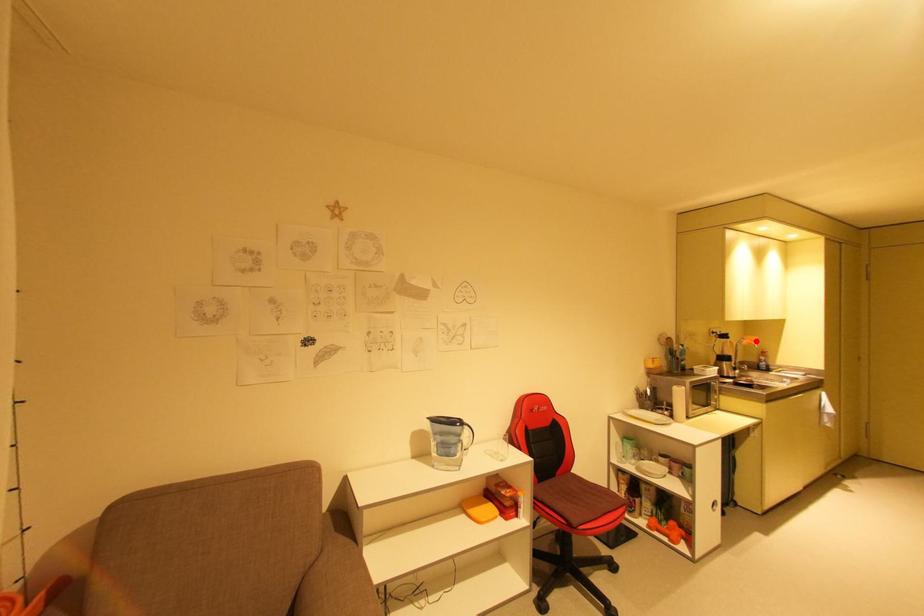
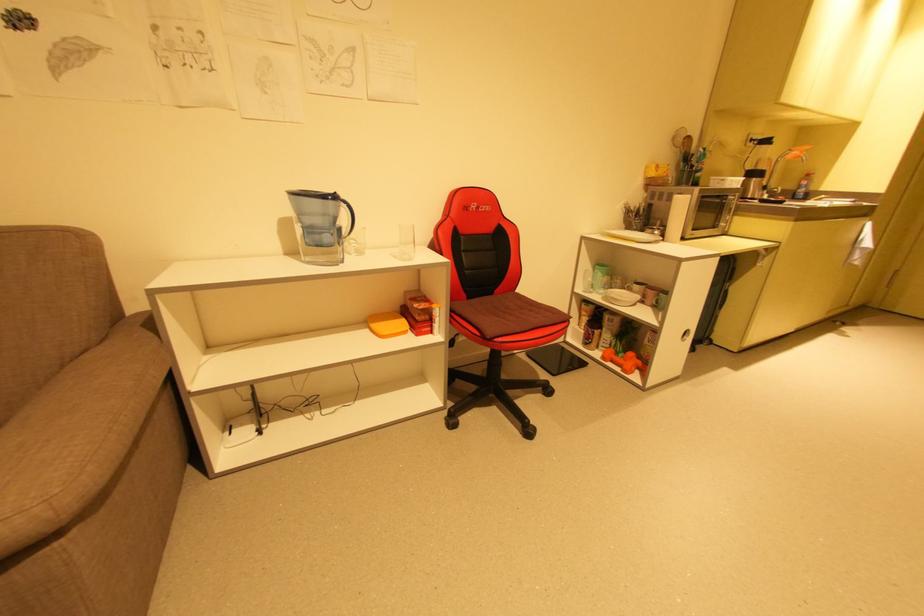
Question: A red point is marked in image1. In image2, is the corresponding 3D point closer to the camera or farther? Reply with the corresponding letter.

Choices:
 (A) The corresponding 3D point is closer.
 (B) The corresponding 3D point is farther.

Answer: (B)